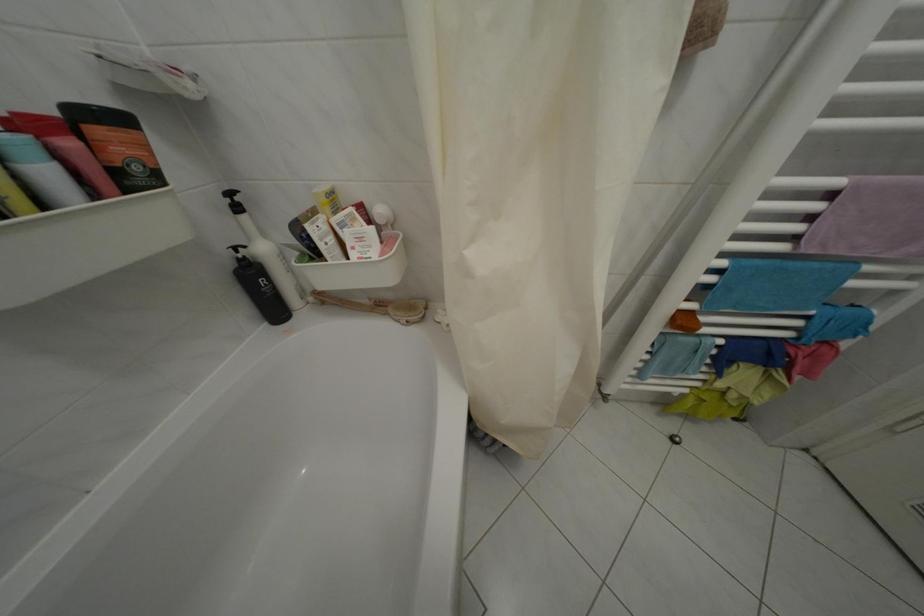
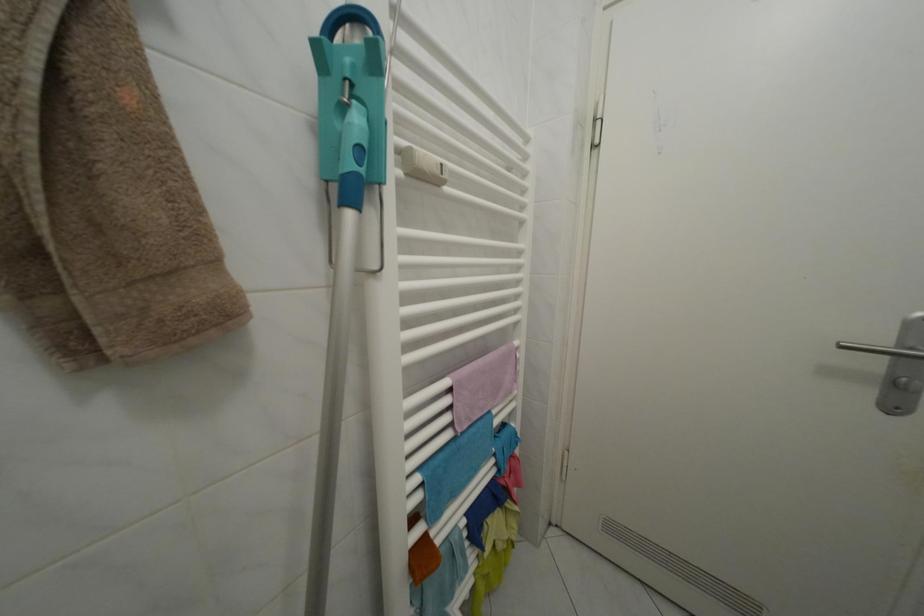
Find the pixel in the second image that matches pixel 841 201 in the first image.

(458, 397)